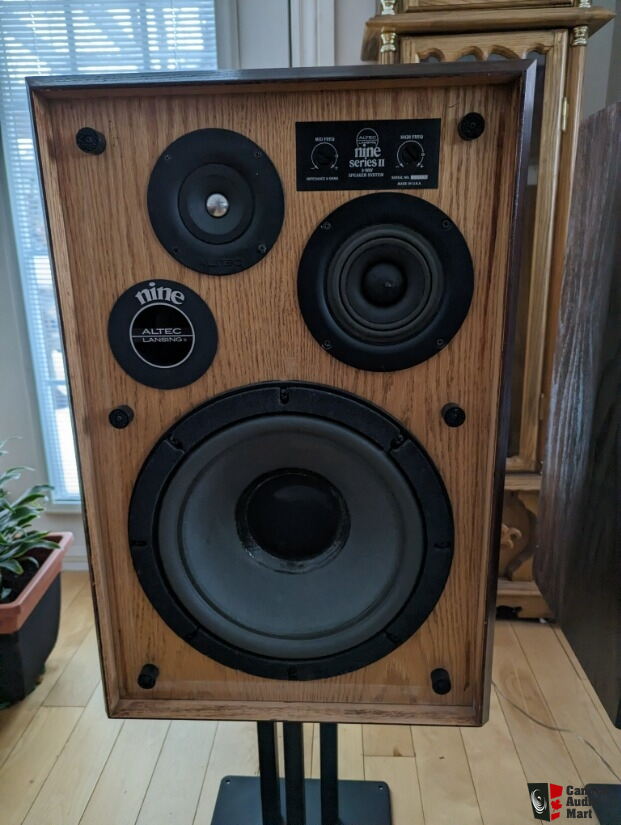
You are a GUI agent. You are given a task and a screenshot of the screen. Output one action in this format:
    pyautogui.click(x=<x>, y=<y>)
    Task: Click on the black pegs holding frame in place
    
    Given the screenshot: What is the action you would take?
    pyautogui.click(x=138, y=677), pyautogui.click(x=450, y=686), pyautogui.click(x=484, y=124), pyautogui.click(x=84, y=130), pyautogui.click(x=112, y=402), pyautogui.click(x=465, y=412)